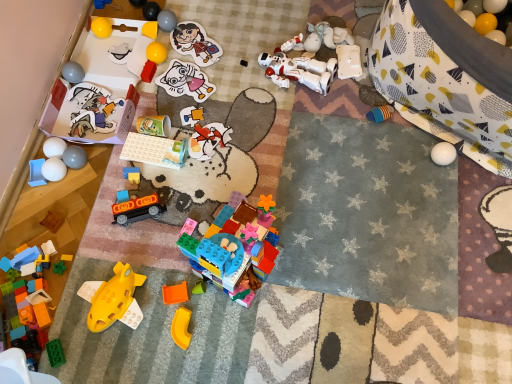
Identify the location of vacant space behind matte paper sticker at center, the nineteenth toy when ordered from left to right. (195, 47).